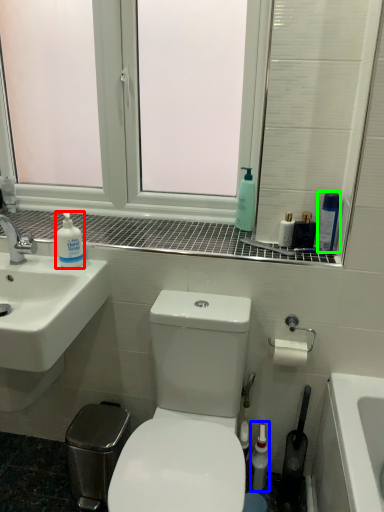
Question: Considering the real-world distances, which object is closest to cleaning product (highlighted by a red box)? mouthwash (highlighted by a blue box) or cleaning product (highlighted by a green box).

Choices:
 (A) mouthwash
 (B) cleaning product

Answer: (B)